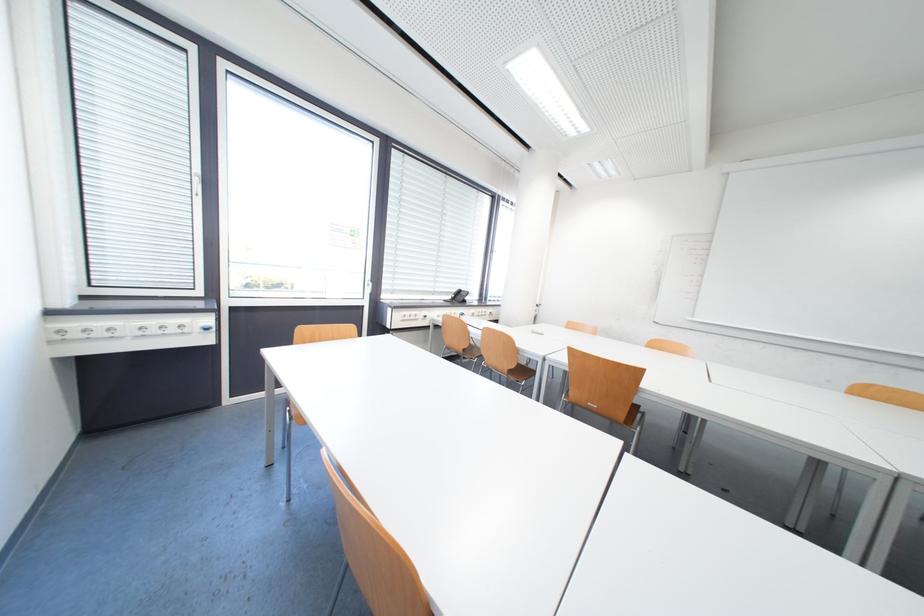
Where would you turn the white window handle? Please return your answer as a coordinate pair (x, y).

(198, 185)